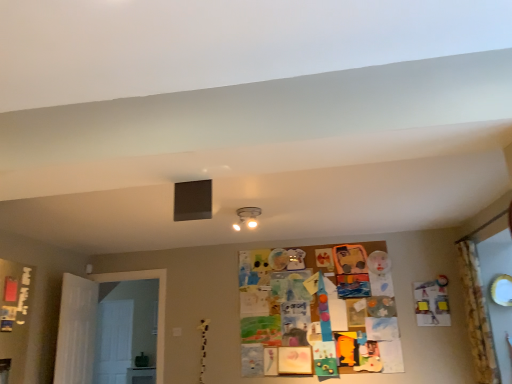
Identify the location of yellow floral fabric curtain at right. (477, 315).

Describe the element at coordinates (477, 315) in the screenshot. I see `yellow floral fabric curtain at right` at that location.

Identify the location of yellow floral fabric curtain at right. The width and height of the screenshot is (512, 384). (477, 315).